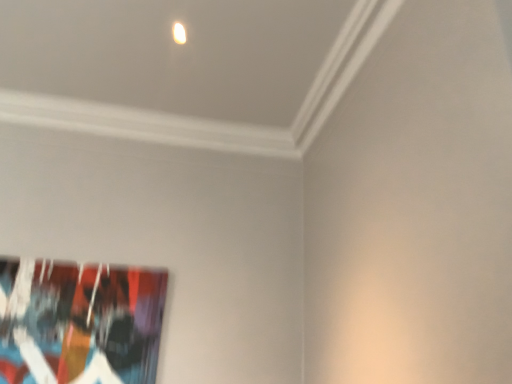
What is the approximate width of matte white light at upper center?

It is 2.68 inches.

Describe the element at coordinates (179, 33) in the screenshot. This screenshot has height=384, width=512. I see `matte white light at upper center` at that location.

The height and width of the screenshot is (384, 512). Find the location of `matte white light at upper center`. matte white light at upper center is located at coordinates (179, 33).

What are the coordinates of `abstract painting at lower left` in the screenshot? It's located at (79, 322).

The image size is (512, 384). What do you see at coordinates (79, 322) in the screenshot?
I see `abstract painting at lower left` at bounding box center [79, 322].

You are a GUI agent. You are given a task and a screenshot of the screen. Output one action in this format:
    pyautogui.click(x=<x>, y=<y>)
    Task: Click on the matte white light at upper center
    
    Given the screenshot: What is the action you would take?
    pyautogui.click(x=179, y=33)

Which object is positioned more to the right, abstract painting at lower left or matte white light at upper center?

matte white light at upper center is more to the right.

From the picture: Which object is further away from the camera, abstract painting at lower left or matte white light at upper center?

Positioned behind is abstract painting at lower left.

Which is less distant, [106,376] or [182,36]?

Point [106,376] is farther from the camera than point [182,36].

From the image's perspective, would you say abstract painting at lower left is shown under matte white light at upper center?

Correct, abstract painting at lower left appears lower than matte white light at upper center in the image.

From a real-world perspective, relative to matte white light at upper center, is abstract painting at lower left vertically above or below?

abstract painting at lower left is below matte white light at upper center.

In the scene shown: Considering the sizes of objects abstract painting at lower left and matte white light at upper center in the image provided, who is thinner, abstract painting at lower left or matte white light at upper center?

Thinner between the two is abstract painting at lower left.

Considering the relative sizes of abstract painting at lower left and matte white light at upper center in the image provided, is abstract painting at lower left shorter than matte white light at upper center?

In fact, abstract painting at lower left may be taller than matte white light at upper center.

Considering the relative sizes of abstract painting at lower left and matte white light at upper center in the image provided, is abstract painting at lower left smaller than matte white light at upper center?

Incorrect, abstract painting at lower left is not smaller in size than matte white light at upper center.

Does abstract painting at lower left contain matte white light at upper center?

Actually, matte white light at upper center is outside abstract painting at lower left.

Is abstract painting at lower left not close to matte white light at upper center?

abstract painting at lower left is positioned a significant distance from matte white light at upper center.

Is abstract painting at lower left oriented away from matte white light at upper center?

No, abstract painting at lower left's orientation is not away from matte white light at upper center.

How many degrees apart are the facing directions of abstract painting at lower left and matte white light at upper center?

There is a 1.21-degree angle between the facing directions of abstract painting at lower left and matte white light at upper center.

This screenshot has height=384, width=512. I want to click on picture frame on the left of matte white light at upper center, so click(79, 322).

Which object is positioned more to the right, matte white light at upper center or abstract painting at lower left?

matte white light at upper center is more to the right.

Considering the positions of objects matte white light at upper center and abstract painting at lower left in the image provided, who is behind, matte white light at upper center or abstract painting at lower left?

abstract painting at lower left is more distant.

Is point (176, 36) farther from viewer compared to point (137, 331)?

That is False.

From the image's perspective, who appears lower, matte white light at upper center or abstract painting at lower left?

abstract painting at lower left is shown below in the image.

From a real-world perspective, does matte white light at upper center stand above abstract painting at lower left?

Yes.

Consider the image. Does matte white light at upper center have a lesser width compared to abstract painting at lower left?

No.

Is matte white light at upper center taller or shorter than abstract painting at lower left?

Clearly, matte white light at upper center is shorter compared to abstract painting at lower left.

Can you confirm if matte white light at upper center is smaller than abstract painting at lower left?

Correct, matte white light at upper center occupies less space than abstract painting at lower left.

In the scene shown: Can we say matte white light at upper center lies outside abstract painting at lower left?

Absolutely, matte white light at upper center is external to abstract painting at lower left.

Does matte white light at upper center touch abstract painting at lower left?

They are not placed beside each other.

Is abstract painting at lower left at the back of matte white light at upper center?

No, matte white light at upper center's orientation is not away from abstract painting at lower left.

From the picture: What's the angular difference between matte white light at upper center and abstract painting at lower left's facing directions?

1.21 degrees.

In order to click on picture frame on the left side of matte white light at upper center in this screenshot , I will do `click(79, 322)`.

Locate an element on the screen. This screenshot has width=512, height=384. light lying in front of the abstract painting at lower left is located at coordinates (179, 33).

At what (x,y) coordinates should I click in order to perform the action: click on picture frame behind the matte white light at upper center. Please return your answer as a coordinate pair (x, y). The height and width of the screenshot is (384, 512). Looking at the image, I should click on (79, 322).